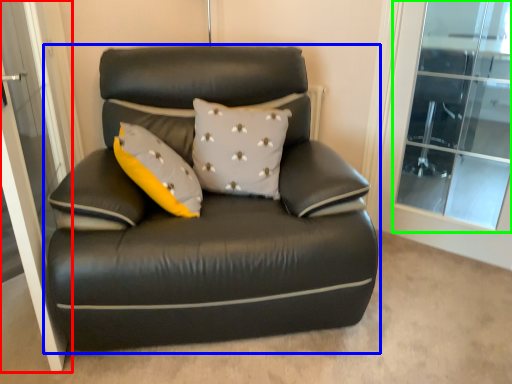
Question: Which is nearer to the screen door (highlighted by a red box)? studio couch (highlighted by a blue box) or window (highlighted by a green box).

Choices:
 (A) studio couch
 (B) window

Answer: (A)